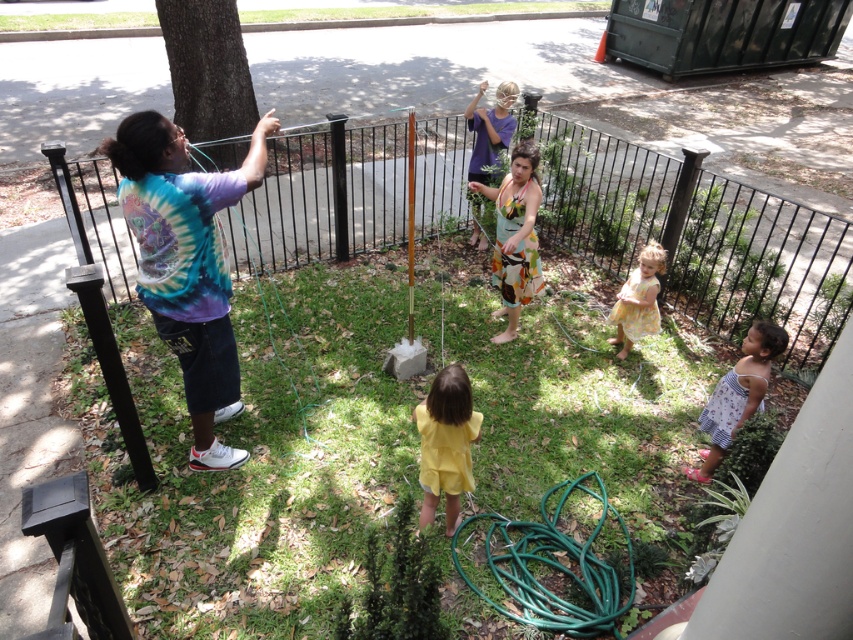
Question: Does green grass at center appear on the right side of floral cotton dress at center?

Choices:
 (A) yes
 (B) no

Answer: (B)

Question: Observing the image, what is the correct spatial positioning of green grass at center in reference to floral cotton dress at center?

Choices:
 (A) above
 (B) below

Answer: (B)

Question: Which point is farther from the camera taking this photo?

Choices:
 (A) (526, 177)
 (B) (231, 209)
 (C) (740, 401)
 (D) (506, 611)

Answer: (B)

Question: Which point appears farthest from the camera in this image?

Choices:
 (A) (450, 433)
 (B) (663, 262)
 (C) (165, 477)

Answer: (B)

Question: Which of the following is the farthest from the observer?

Choices:
 (A) green rubber hose at left
 (B) black metal fence at upper center
 (C) green grass at center
 (D) floral cotton dress at center

Answer: (B)

Question: Is black metal fence at upper center positioned before matte purple shirt at center?

Choices:
 (A) no
 (B) yes

Answer: (A)